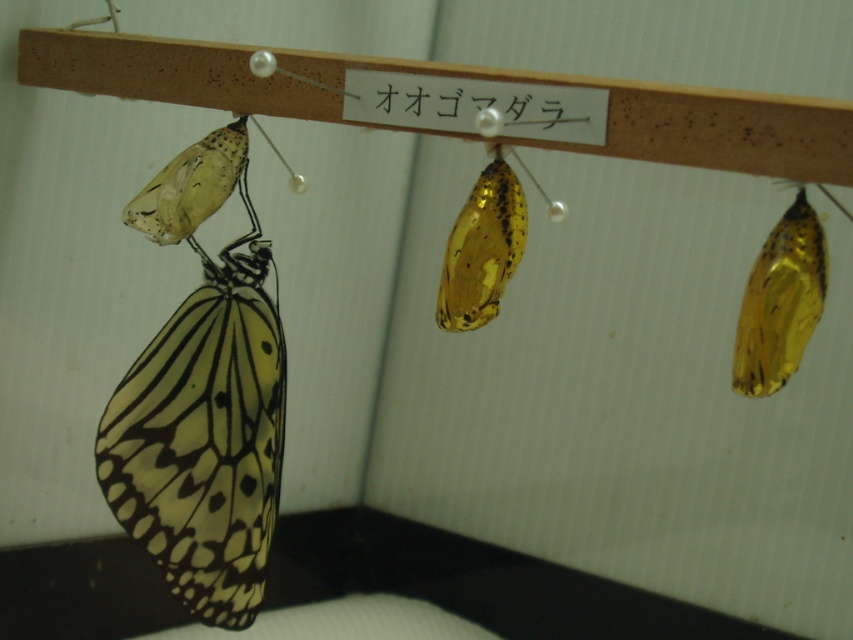
You are standing 1.11 meters away from the point at coordinates point (463, 241) in the scene. If you want to take a photo of the chrysalises and butterfly displayed on the wooden board, will you be able to capture all of them in a single frame without moving?

The point at coordinates point (463, 241) is 1.11 meters away from the camera. Since the chrysalises and butterfly are all displayed on the same wooden board, they are likely within the same plane and field of view. Therefore, you should be able to capture all of them in a single frame without moving.

You are an entomologist observing the display setup. You need to document the positions of the translucent amber chrysalis at right and the translucent yellow pupa at center. Based on their positions, which one is located to the east of the other?

The translucent amber chrysalis at right is positioned on the right side of the translucent yellow pupa at center, so if the image is viewed with the standard orientation where left is west and right is east, the translucent amber chrysalis at right is to the east of the translucent yellow pupa at center.

You are an entomologist studying the chrysalis display. You need to locate the translucent yellow pupa at center for a close examination. What are its coordinates in the image?

The translucent yellow pupa at center is located at coordinates point (482, 248).